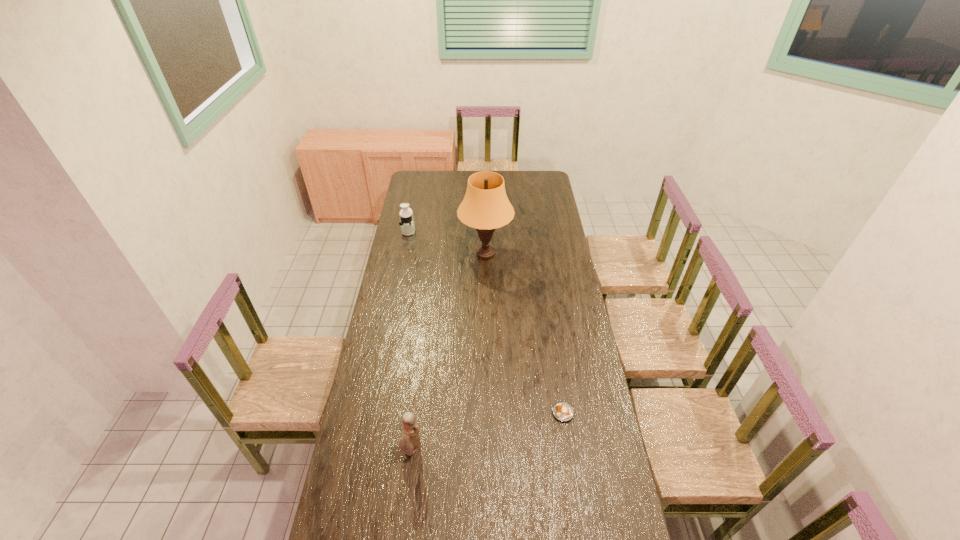
Where is `free space located 0.320m on the front of the leftmost object`? This screenshot has height=540, width=960. free space located 0.320m on the front of the leftmost object is located at coordinates (399, 276).

Find the location of a particular element. vacant space located on the back of the shortest object is located at coordinates (557, 375).

Image resolution: width=960 pixels, height=540 pixels. Find the location of `object positioned at the left edge`. object positioned at the left edge is located at coordinates (406, 215).

This screenshot has width=960, height=540. Identify the location of object at the right edge. (562, 411).

You are a GUI agent. You are given a task and a screenshot of the screen. Output one action in this format:
    pyautogui.click(x=<x>, y=<y>)
    Task: Click on the vacant space at the left edge
    
    Given the screenshot: What is the action you would take?
    tap(414, 214)

Where is `vacant space at the right edge`? The height and width of the screenshot is (540, 960). vacant space at the right edge is located at coordinates 539,228.

Find the location of a particular element. The image size is (960, 540). vacant space in between the shortest object and the third tallest object is located at coordinates (486, 322).

Identify the location of unoccupied area between the leftmost object and the lampshade. (447, 242).

Find the location of a particular element. This screenshot has height=540, width=960. free space between the third farthest object and the tallest object is located at coordinates (524, 333).

The image size is (960, 540). Find the location of `blank region between the nearest object and the farthest object`. blank region between the nearest object and the farthest object is located at coordinates (410, 340).